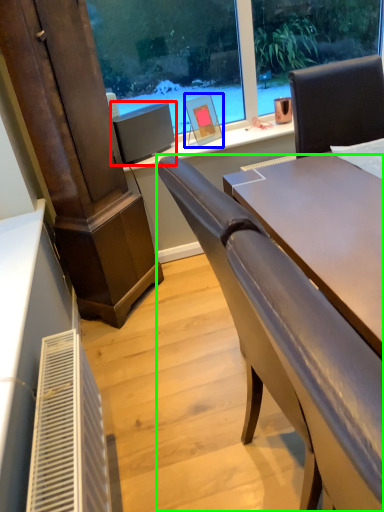
Question: Which object is positioned closest to computer monitor (highlighted by a red box)? Select from picture frame (highlighted by a blue box) and chair (highlighted by a green box).

Choices:
 (A) picture frame
 (B) chair

Answer: (A)